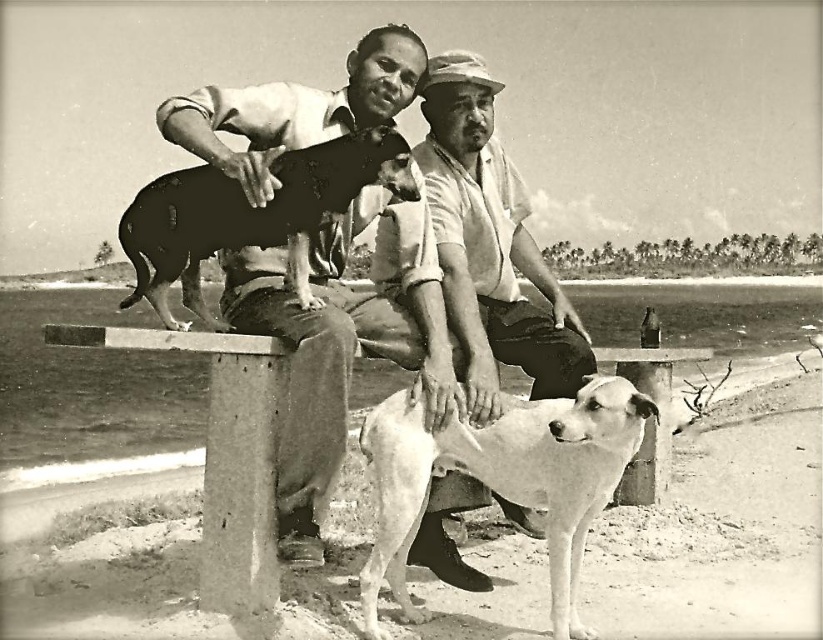
Question: Considering the real-world distances, which object is closest to the metallic bench at center?

Choices:
 (A) smooth leather jacket at center
 (B) smooth white shirt at center
 (C) concrete bench at center

Answer: (A)

Question: Among these points, which one is nearest to the camera?

Choices:
 (A) (291, 269)
 (B) (524, 481)
 (C) (528, 269)
 (D) (238, 541)

Answer: (B)

Question: Does smooth leather jacket at center have a lesser width compared to concrete bench at center?

Choices:
 (A) yes
 (B) no

Answer: (B)

Question: Is smooth white shirt at center to the right of concrete bench at center from the viewer's perspective?

Choices:
 (A) yes
 (B) no

Answer: (A)

Question: Which object is the farthest from the metallic bench at center?

Choices:
 (A) smooth white shirt at center
 (B) white smooth dog at center

Answer: (A)

Question: Can you confirm if white smooth dog at center is smaller than concrete bench at center?

Choices:
 (A) yes
 (B) no

Answer: (B)